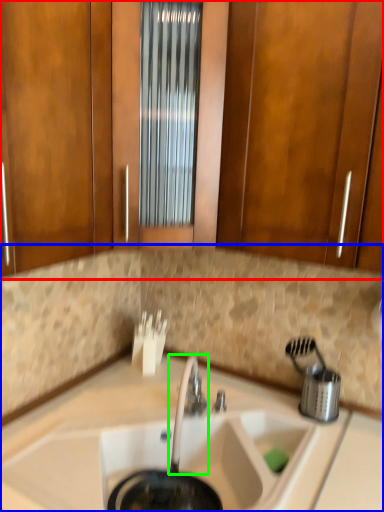
Question: Considering the real-world distances, which object is farthest from cabinetry (highlighted by a red box)? countertop (highlighted by a blue box) or tap (highlighted by a green box)?

Choices:
 (A) countertop
 (B) tap

Answer: (B)